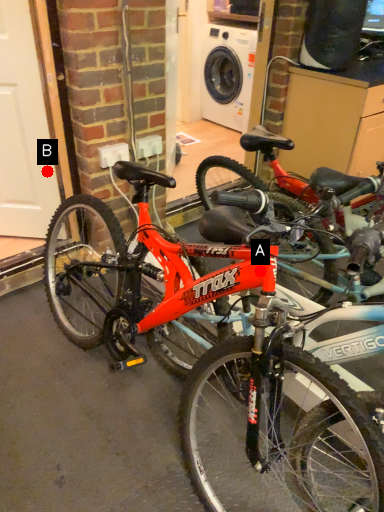
Question: Two points are circled on the image, labeled by A and B beside each circle. Which point is farther to the camera?

Choices:
 (A) A is further
 (B) B is further

Answer: (B)